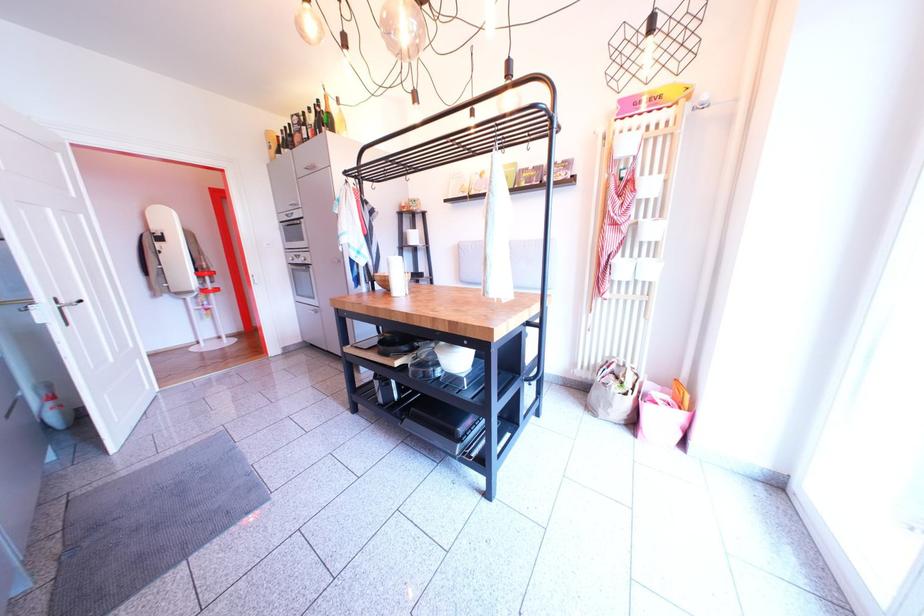
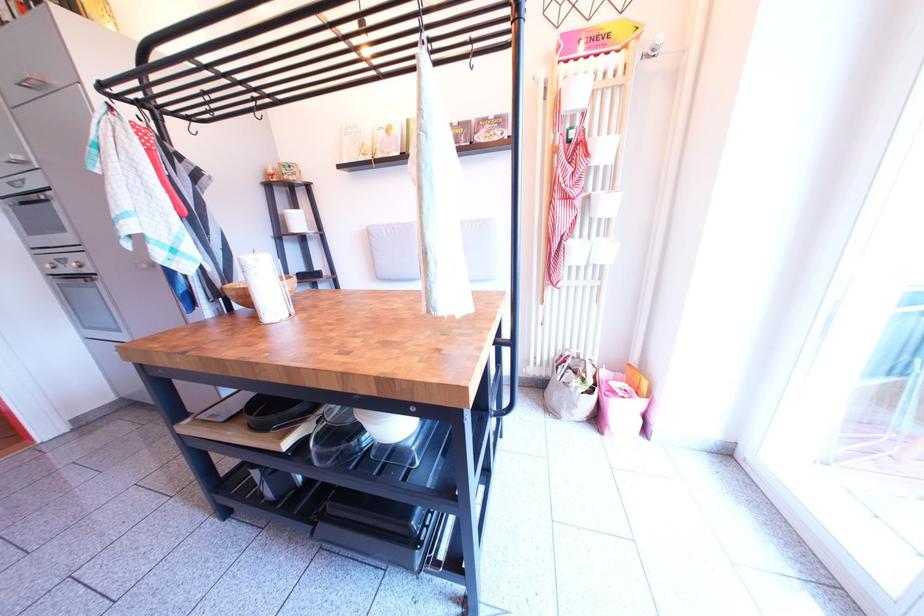
Find the pixel in the second image that matches the point at 392,353 in the first image.

(263, 423)